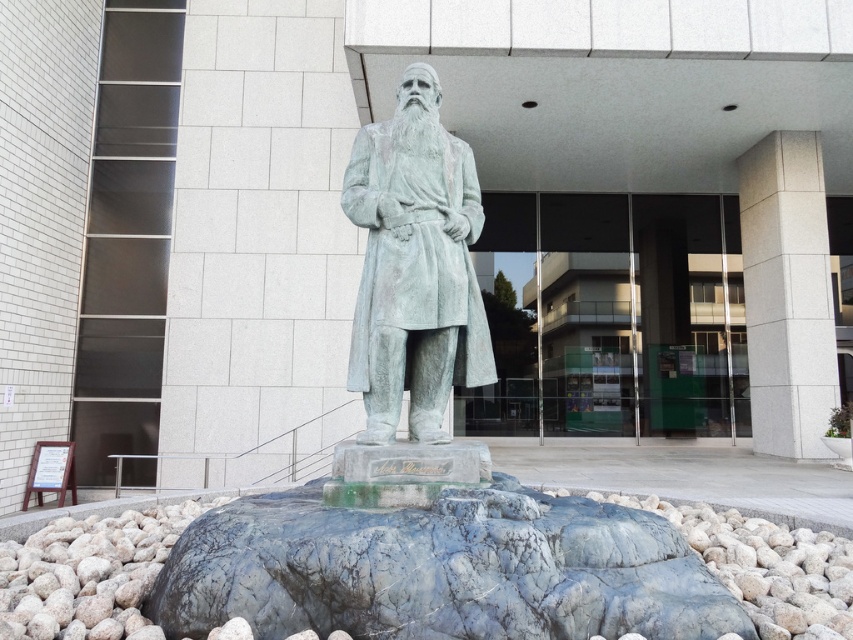
Question: Does green marble fountain at center have a smaller size compared to green patina statue at center?

Choices:
 (A) yes
 (B) no

Answer: (B)

Question: Which object is closer to the camera taking this photo?

Choices:
 (A) green patina statue at center
 (B) green marble fountain at center

Answer: (B)

Question: Is the position of green marble fountain at center less distant than that of green patina statue at center?

Choices:
 (A) no
 (B) yes

Answer: (B)

Question: Can you confirm if green marble fountain at center is positioned to the right of green patina statue at center?

Choices:
 (A) yes
 (B) no

Answer: (A)